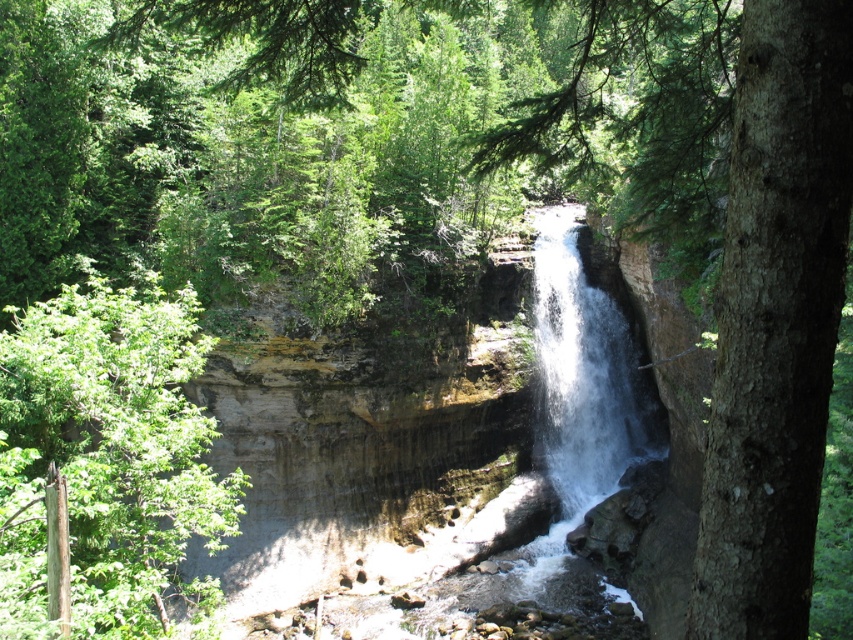
You are standing at the edge of the cliff near the waterfall. You see the green rough bark tree at center right and the white frothy water at center. Which object is higher in elevation?

The green rough bark tree at center right is above the white frothy water at center, so it has a higher elevation.

You are a hiker standing at the base of the waterfall and want to take a photo of both the green rough bark tree at center right and the green leafy tree at center. Which tree should you position yourself closer to in order to capture both in the same frame?

You should position yourself closer to the green leafy tree at center because the green rough bark tree at center right is on its right side, allowing both trees to be included in the frame when moving towards the central tree.